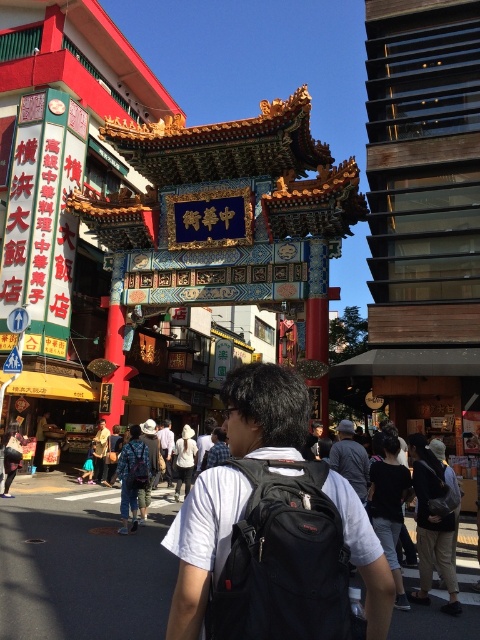
Is dark gray fabric jacket at center bigger than blue denim backpack at center?

Correct, dark gray fabric jacket at center is larger in size than blue denim backpack at center.

Between point (337, 428) and point (132, 444), which one is positioned in front?

Positioned in front is point (132, 444).

Who is more distant from viewer, (337, 444) or (145, 451)?

Positioned behind is point (145, 451).

Where is `dark gray fabric jacket at center`? The height and width of the screenshot is (640, 480). dark gray fabric jacket at center is located at coordinates (350, 460).

Is the position of black backpack at center less distant than that of blue denim backpack at center?

Yes, it is in front of blue denim backpack at center.

Is black backpack at center further to camera compared to blue denim backpack at center?

No, it is in front of blue denim backpack at center.

At what (x,y) coordinates should I click in order to perform the action: click on black backpack at center. Please return your answer as a coordinate pair (x, y). The width and height of the screenshot is (480, 640). Looking at the image, I should click on (272, 529).

Find the location of a particular element. black backpack at center is located at coordinates click(x=272, y=529).

Can you confirm if black backpack at center is positioned to the right of black fabric backpack at center?

Incorrect, black backpack at center is not on the right side of black fabric backpack at center.

Image resolution: width=480 pixels, height=640 pixels. What are the coordinates of `black backpack at center` in the screenshot? It's located at (272, 529).

Find the location of a particular element. This screenshot has width=480, height=640. black backpack at center is located at coordinates (272, 529).